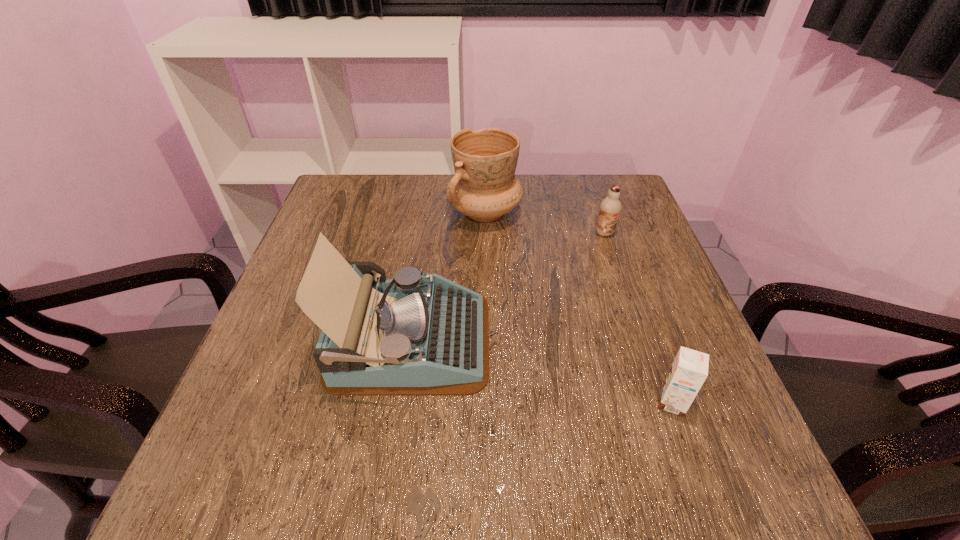
In order to click on free space that satisfies the following two spatial constraints: 1. on the front side of the nearer chocolate milk; 2. on the right side of the farther chocolate milk in this screenshot , I will do `click(661, 403)`.

Where is `blank area in the image that satisfies the following two spatial constraints: 1. on the typing side of the nearer chocolate milk; 2. on the left side of the typewriter`? This screenshot has height=540, width=960. blank area in the image that satisfies the following two spatial constraints: 1. on the typing side of the nearer chocolate milk; 2. on the left side of the typewriter is located at coordinates (401, 403).

The width and height of the screenshot is (960, 540). In order to click on free space that satisfies the following two spatial constraints: 1. on the typing side of the typewriter; 2. on the back side of the nearer chocolate milk in this screenshot , I will do `click(401, 403)`.